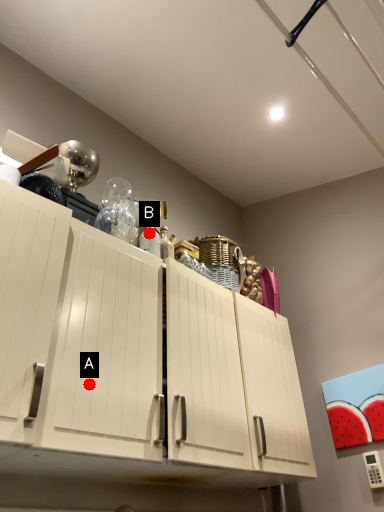
Question: Two points are circled on the image, labeled by A and B beside each circle. Among these points, which one is farthest from the camera?

Choices:
 (A) A is further
 (B) B is further

Answer: (B)